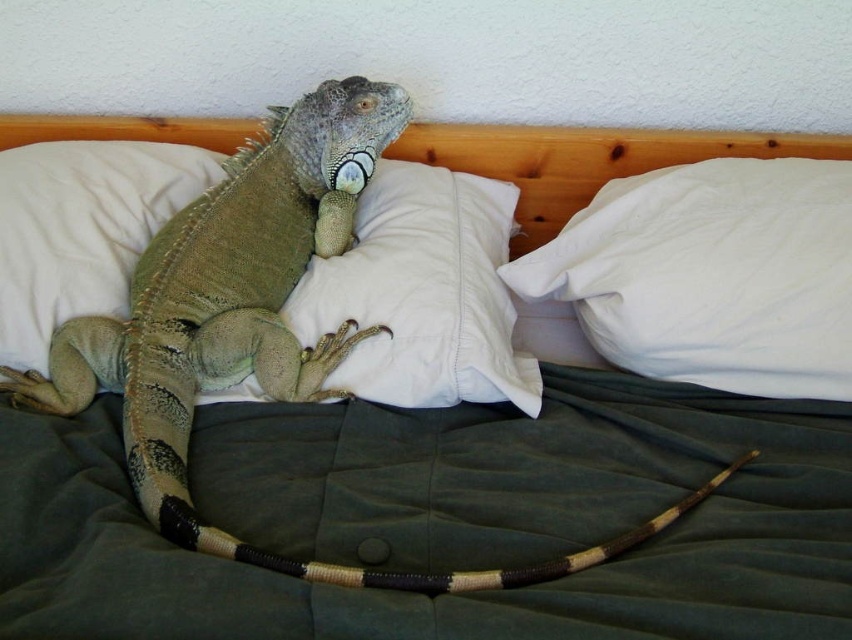
You need to place a small decorative item on the pillow that has more space. Which pillow should you choose between the white soft pillow at upper right and the green textured pillow at center?

The white soft pillow at upper right has a larger width than the green textured pillow at center, so you should place the small decorative item on the white soft pillow at upper right as it has more space.

You are trying to place a small decorative item on the highest pillow in the scene. Which pillow should you choose between the white soft pillow at upper right and the white soft pillow at center?

You should choose the white soft pillow at center because it has a greater height than the white soft pillow at upper right.

You are a pet sitter who needs to place a small water bowl between the white soft pillow at upper right and the white soft pillow at center. The bowl requires 10 inches of space. Is there enough space between them?

The white soft pillow at upper right and white soft pillow at center are 8.28 inches apart. Since the required space for the bowl is 10 inches, there is not enough space between them.